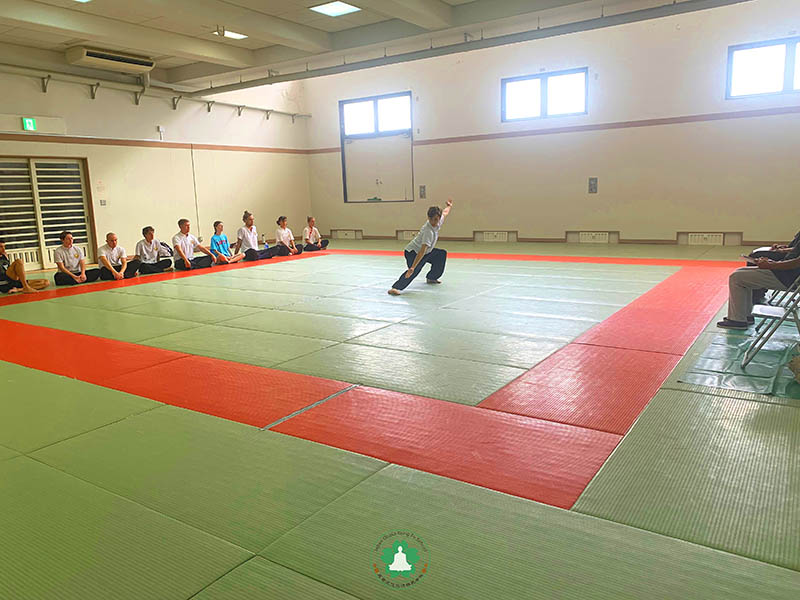
Locate an element on the screen. place to sit is located at coordinates click(774, 308).